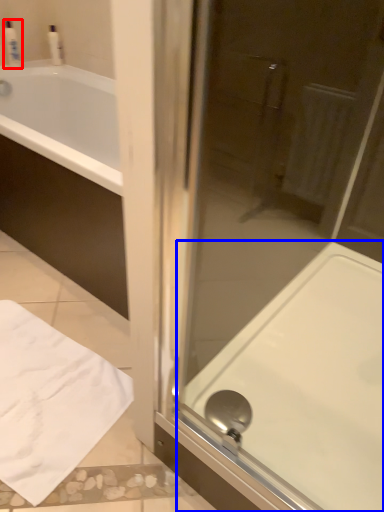
Question: Among these objects, which one is farthest to the camera, toiletry (highlighted by a red box) or bath (highlighted by a blue box)?

Choices:
 (A) toiletry
 (B) bath

Answer: (A)